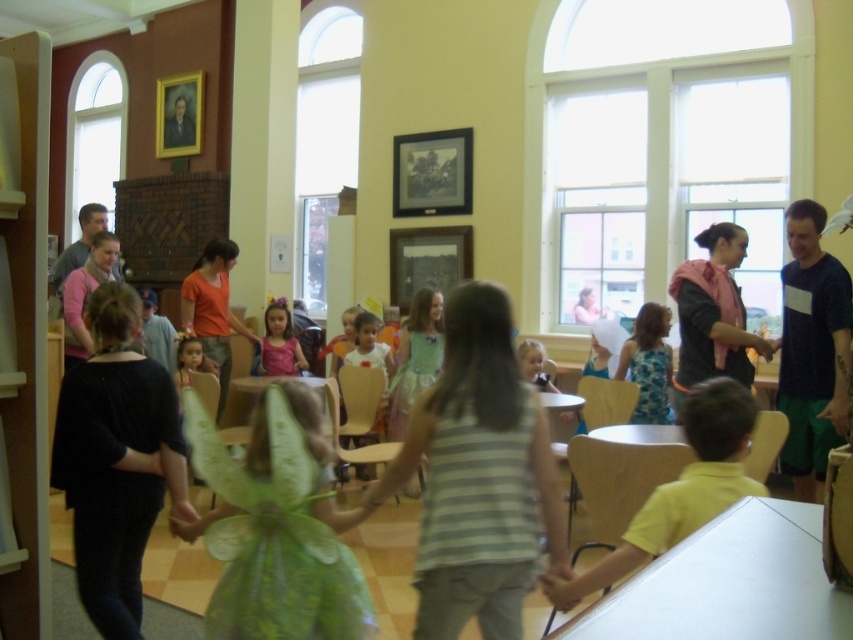
Question: Does yellow matte shirt at lower right have a smaller size compared to pink satin dress at center?

Choices:
 (A) no
 (B) yes

Answer: (B)

Question: Does green fabric dress at center have a larger size compared to green tulle dress at center?

Choices:
 (A) yes
 (B) no

Answer: (A)

Question: Which object appears farthest from the camera in this image?

Choices:
 (A) pink fabric at center
 (B) pink satin dress at center
 (C) green fabric dress at center

Answer: (B)

Question: Which is farther from the pink fabric at center?

Choices:
 (A) pink satin dress at center
 (B) green tulle dress at center
 (C) yellow matte shirt at lower right
 (D) green fabric dress at center

Answer: (A)

Question: Can you confirm if green fabric dress at center is positioned to the left of pink fabric at center?

Choices:
 (A) no
 (B) yes

Answer: (B)

Question: Which object is farther from the camera taking this photo?

Choices:
 (A) yellow matte shirt at lower right
 (B) green fabric dress at center
 (C) dark blue t-shirt at right
 (D) pink fabric at center

Answer: (D)